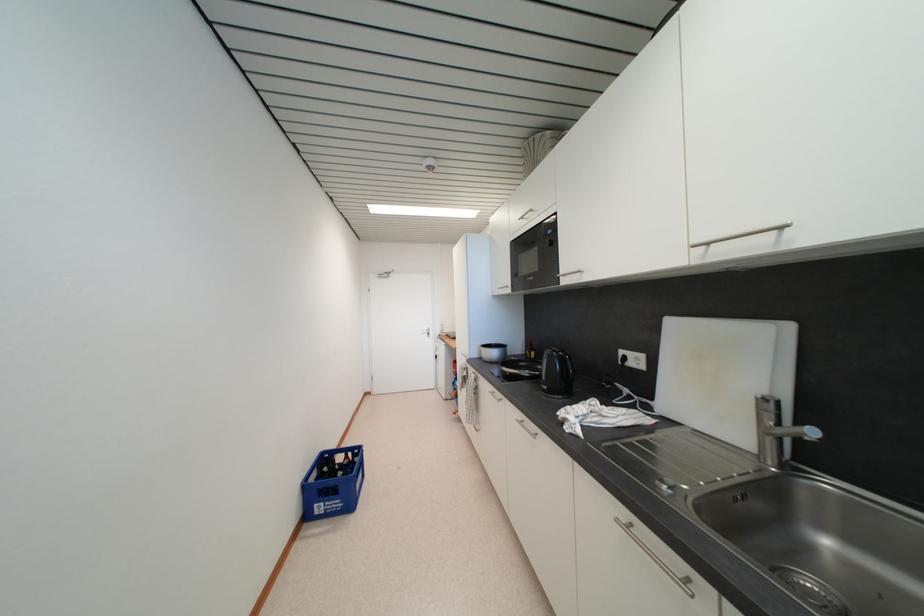
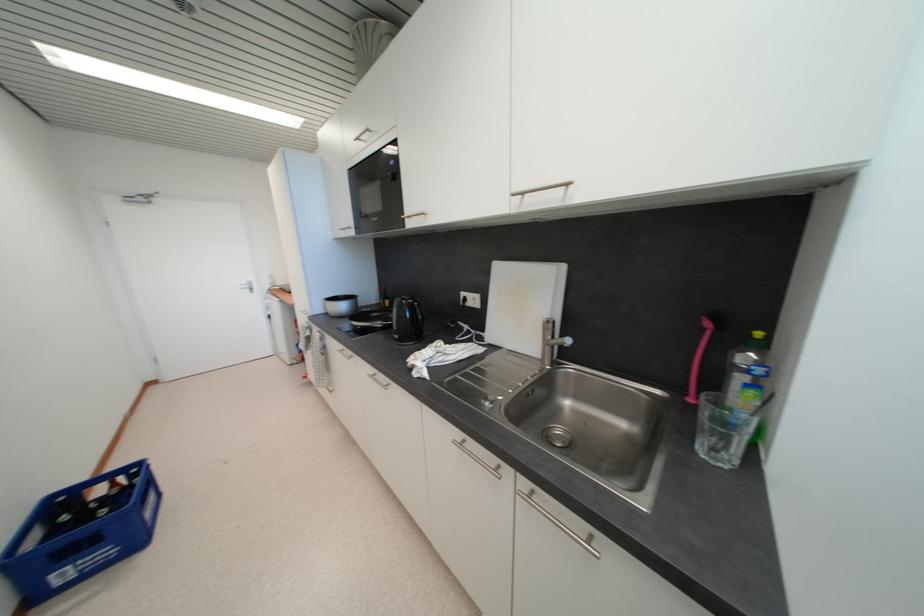
Find the pixel in the second image that matches pixel 485 361 in the first image.

(332, 315)